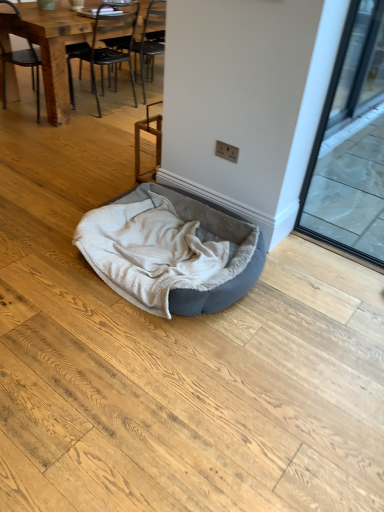
Question: Considering the relative sizes of black metal chair at upper left, the first chair in the right-to-left sequence, and wooden chair at left, the first chair viewed from the left, in the image provided, is black metal chair at upper left, the first chair in the right-to-left sequence, wider than wooden chair at left, the first chair viewed from the left,?

Choices:
 (A) no
 (B) yes

Answer: (B)

Question: From the image's perspective, is black metal chair at upper left, the first chair in the right-to-left sequence, located beneath wooden chair at left, acting as the 2th chair starting from the right?

Choices:
 (A) yes
 (B) no

Answer: (B)

Question: Could you tell me if black metal chair at upper left, the first chair in the right-to-left sequence, is turned towards wooden chair at left, the first chair viewed from the left?

Choices:
 (A) no
 (B) yes

Answer: (A)

Question: From a real-world perspective, is black metal chair at upper left, the second chair in the left-to-right sequence, under wooden chair at left, acting as the 2th chair starting from the right?

Choices:
 (A) yes
 (B) no

Answer: (A)

Question: From the image's perspective, is velvet grey dog bed at center positioned above or below black metal chair at upper left, the first chair in the right-to-left sequence?

Choices:
 (A) below
 (B) above

Answer: (A)

Question: In terms of width, does velvet grey dog bed at center look wider or thinner when compared to black metal chair at upper left, the first chair in the right-to-left sequence?

Choices:
 (A) wide
 (B) thin

Answer: (A)

Question: From a real-world perspective, is velvet grey dog bed at center above or below black metal chair at upper left, the first chair in the right-to-left sequence?

Choices:
 (A) below
 (B) above

Answer: (A)

Question: Is velvet grey dog bed at center taller or shorter than black metal chair at upper left, the second chair in the left-to-right sequence?

Choices:
 (A) tall
 (B) short

Answer: (B)

Question: Does point (74, 54) appear closer or farther from the camera than point (61, 83)?

Choices:
 (A) closer
 (B) farther

Answer: (A)

Question: In terms of width, does black metal chair at upper left, the first chair in the right-to-left sequence, look wider or thinner when compared to wooden chair at left, acting as the 2th chair starting from the right?

Choices:
 (A) wide
 (B) thin

Answer: (A)

Question: From a real-world perspective, is black metal chair at upper left, the second chair in the left-to-right sequence, positioned above or below wooden chair at left, acting as the 2th chair starting from the right?

Choices:
 (A) below
 (B) above

Answer: (A)

Question: In the image, is black metal chair at upper left, the first chair in the right-to-left sequence, on the left side or the right side of wooden chair at left, the first chair viewed from the left?

Choices:
 (A) right
 (B) left

Answer: (A)

Question: Based on their positions, is wooden chair at left, acting as the 2th chair starting from the right, located to the left or right of velvet grey dog bed at center?

Choices:
 (A) right
 (B) left

Answer: (B)

Question: Looking at the image, does wooden chair at left, acting as the 2th chair starting from the right, seem bigger or smaller compared to velvet grey dog bed at center?

Choices:
 (A) small
 (B) big

Answer: (B)